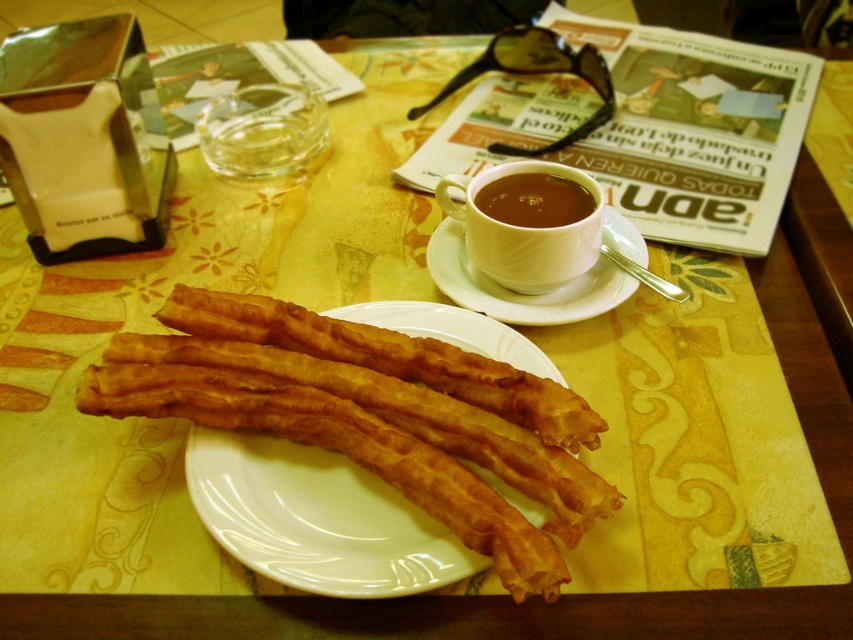
You are a customer at a cafe and want to place your phone on the table without covering any of the visible parts of the white ceramic cup at upper center. Given that the cup is located at coordinates 0.364, 0.615, where should you place your phone?

Place your phone away from the coordinates [524,232] where the white ceramic cup at upper center is located to avoid covering it.

You are a person with a height of 5 feet 6 inches. You are sitting at the table and want to reach the point at coordinates point (595, 248). Can you comfortably reach that point without moving your chair?

The point (595, 248) is 18.59 inches from the viewer. Since the average arm length for a person of 5 feet 6 inches is about 26 inches, you can comfortably reach the point without moving your chair.